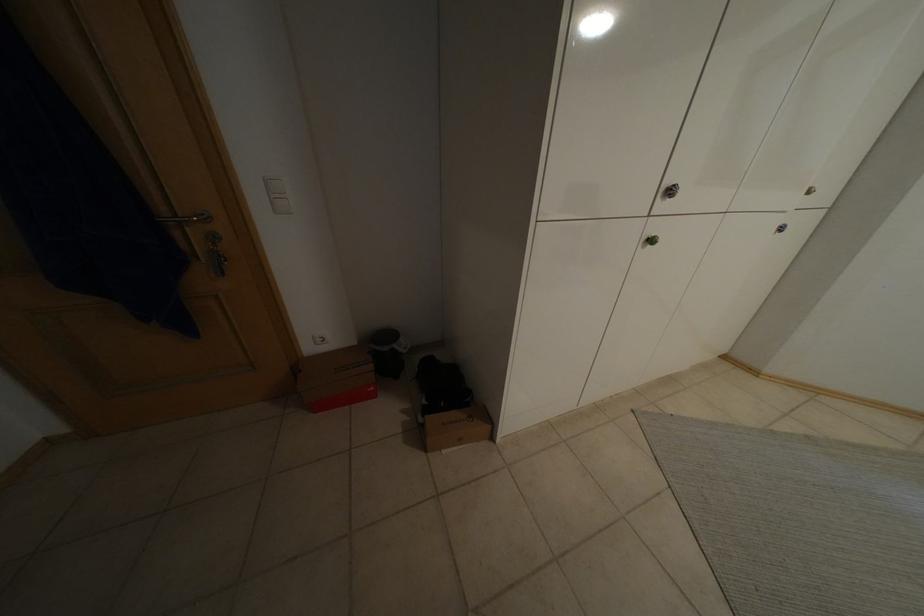
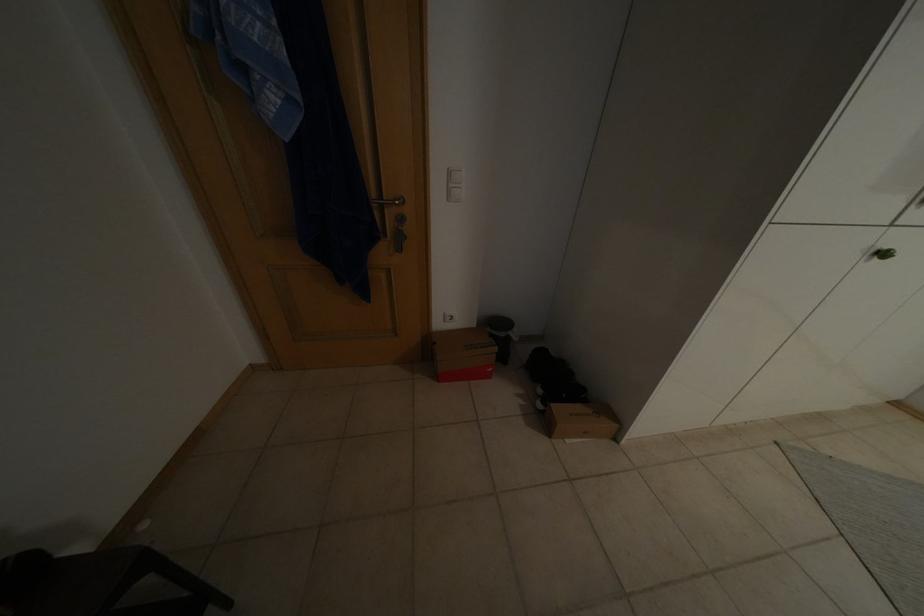
Question: What movement of the cameraman would produce the second image?

Choices:
 (A) Left
 (B) Right
 (C) Forward
 (D) Backward

Answer: (A)